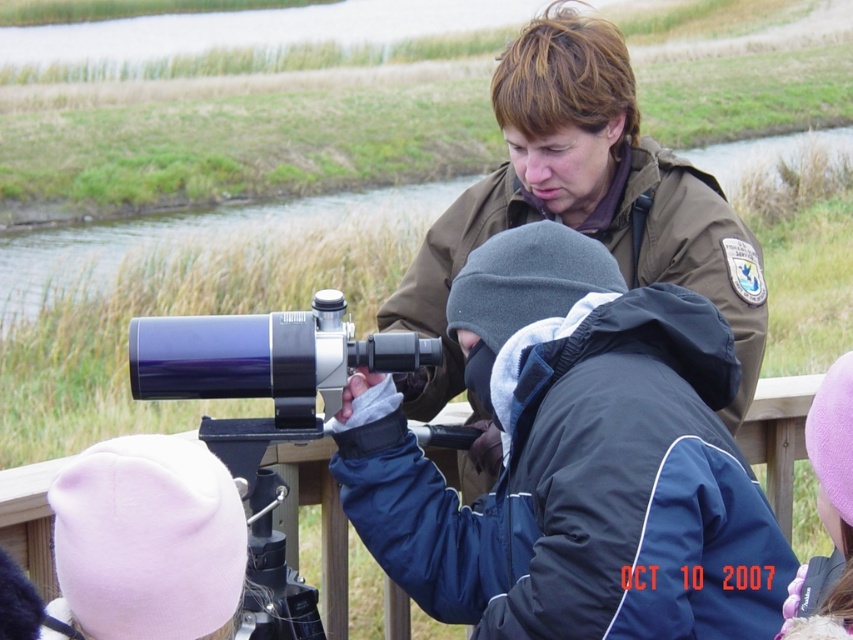
Question: Among these points, which one is nearest to the camera?

Choices:
 (A) (264, 577)
 (B) (363, 460)

Answer: (A)

Question: Which of the following is the farthest from the observer?

Choices:
 (A) dark blue fabric jacket at center
 (B) purple fleece hat at lower right

Answer: (A)

Question: Can you confirm if dark blue fabric jacket at center is smaller than purple fleece hat at lower right?

Choices:
 (A) no
 (B) yes

Answer: (A)

Question: Which of the following is the closest to the observer?

Choices:
 (A) matte black telescope at center
 (B) purple fleece hat at lower right
 (C) dark blue fabric jacket at center

Answer: (B)

Question: Can you confirm if dark blue fabric jacket at center is positioned to the right of matte black telescope at center?

Choices:
 (A) yes
 (B) no

Answer: (A)

Question: Can you confirm if dark blue fabric jacket at center is wider than purple fleece hat at lower right?

Choices:
 (A) yes
 (B) no

Answer: (A)